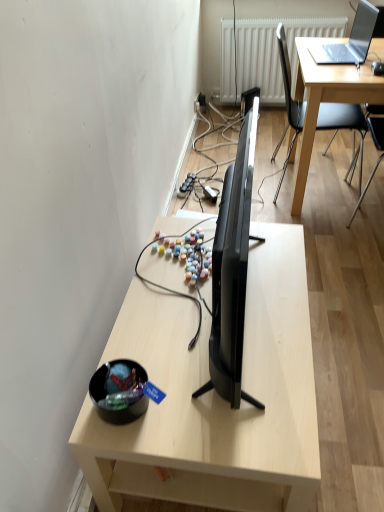
Locate an element on the screen. The width and height of the screenshot is (384, 512). shiny black bowl at lower left is located at coordinates (117, 391).

At what (x,y) coordinates should I click in order to perform the action: click on light wood desk at center. Please return your answer as a coordinate pair (x, y). The image size is (384, 512). Looking at the image, I should click on (215, 397).

Image resolution: width=384 pixels, height=512 pixels. What do you see at coordinates (265, 54) in the screenshot?
I see `white textured radiator at upper center` at bounding box center [265, 54].

You are a GUI agent. You are given a task and a screenshot of the screen. Output one action in this format:
    pyautogui.click(x=<x>, y=<y>)
    Task: Click on the shiny black bowl at lower left
    
    Given the screenshot: What is the action you would take?
    pyautogui.click(x=117, y=391)

From the image's perspective, who appears lower, sleek silver laptop at upper right or white textured radiator at upper center?

sleek silver laptop at upper right, from the image's perspective.

What's the angular difference between sleek silver laptop at upper right and white textured radiator at upper center's facing directions?

84.7 degrees.

The height and width of the screenshot is (512, 384). I want to click on radiator above the sleek silver laptop at upper right (from the image's perspective), so click(265, 54).

Can you confirm if sleek silver laptop at upper right is bigger than white textured radiator at upper center?

No.

Considering the positions of point (293, 138) and point (372, 6), is point (293, 138) closer or farther from the camera than point (372, 6)?

Point (293, 138) appears to be closer to the viewer than point (372, 6).

Looking at this image, is black plastic chair at upper right bigger or smaller than sleek silver laptop at upper right?

Clearly, black plastic chair at upper right is larger in size than sleek silver laptop at upper right.

Image resolution: width=384 pixels, height=512 pixels. I want to click on chair on the left of sleek silver laptop at upper right, so click(x=288, y=103).

From a real-world perspective, is black plastic chair at upper right above or below sleek silver laptop at upper right?

black plastic chair at upper right is below sleek silver laptop at upper right.

Can white textured radiator at upper center be found inside black plastic chair at upper right?

Actually, white textured radiator at upper center is outside black plastic chair at upper right.

Considering the positions of points (297, 128) and (261, 79), is point (297, 128) closer to camera compared to point (261, 79)?

Yes, it is.

Considering the relative sizes of black plastic chair at upper right and white textured radiator at upper center in the image provided, is black plastic chair at upper right shorter than white textured radiator at upper center?

No, black plastic chair at upper right is not shorter than white textured radiator at upper center.

Who is more distant, black plastic chair at upper right or white textured radiator at upper center?

white textured radiator at upper center.

How far apart are white textured radiator at upper center and light wood desk at center?

white textured radiator at upper center is 2.48 meters away from light wood desk at center.

Is light wood desk at center located within white textured radiator at upper center?

No, light wood desk at center is not a part of white textured radiator at upper center.

Is white textured radiator at upper center looking in the opposite direction of light wood desk at center?

No, white textured radiator at upper center's orientation is not away from light wood desk at center.

Which is more to the right, white textured radiator at upper center or light wood desk at center?

From the viewer's perspective, white textured radiator at upper center appears more on the right side.

From the image's perspective, is shiny black bowl at lower left located above or below light wood desk at center?

shiny black bowl at lower left is situated higher than light wood desk at center in the image.

From a real-world perspective, is shiny black bowl at lower left physically below light wood desk at center?

Actually, shiny black bowl at lower left is physically above light wood desk at center in the real world.

Is shiny black bowl at lower left inside the boundaries of light wood desk at center, or outside?

shiny black bowl at lower left is not inside light wood desk at center, it's outside.

Is shiny black bowl at lower left wider or thinner than light wood desk at center?

Clearly, shiny black bowl at lower left has less width compared to light wood desk at center.

Identify the location of chair lying in front of the white textured radiator at upper center. (288, 103).

Is white textured radiator at upper center oriented away from black plastic chair at upper right?

No.

From a real-world perspective, relative to black plastic chair at upper right, is white textured radiator at upper center vertically above or below?

white textured radiator at upper center is situated lower than black plastic chair at upper right in the real world.

Does black glossy tv at center come in front of shiny black bowl at lower left?

Yes, black glossy tv at center is closer to the viewer.

Is black glossy tv at center positioned beyond the bounds of shiny black bowl at lower left?

Yes.

Based on the photo, which object is wider, black glossy tv at center or shiny black bowl at lower left?

With larger width is black glossy tv at center.

Considering the sizes of objects black glossy tv at center and shiny black bowl at lower left in the image provided, who is bigger, black glossy tv at center or shiny black bowl at lower left?

Bigger between the two is black glossy tv at center.

Identify the location of laptop on the right side of white textured radiator at upper center. Image resolution: width=384 pixels, height=512 pixels. (350, 40).

Locate an element on the screen. laptop above the black plastic chair at upper right (from the image's perspective) is located at coordinates (350, 40).

In the scene shown: Considering their positions, is shiny black bowl at lower left positioned closer to black glossy tv at center than light wood desk at center?

Among the two, light wood desk at center is located nearer to black glossy tv at center.

Estimate the real-world distances between objects in this image. Which object is closer to light wood desk at center, black plastic chair at upper right or shiny black bowl at lower left?

shiny black bowl at lower left is positioned closer to the anchor light wood desk at center.

Which object lies further to the anchor point black glossy tv at center, white textured radiator at upper center or light wood desk at center?

white textured radiator at upper center is further to black glossy tv at center.

Based on their spatial positions, is black plastic chair at upper right or sleek silver laptop at upper right closer to white textured radiator at upper center?

The object closer to white textured radiator at upper center is black plastic chair at upper right.

Considering their positions, is sleek silver laptop at upper right positioned further to white textured radiator at upper center than shiny black bowl at lower left?

Based on the image, shiny black bowl at lower left appears to be further to white textured radiator at upper center.

Looking at the image, which one is located closer to white textured radiator at upper center, light wood desk at center or black glossy tv at center?

The object closer to white textured radiator at upper center is black glossy tv at center.

Considering their positions, is white textured radiator at upper center positioned further to black glossy tv at center than shiny black bowl at lower left?

white textured radiator at upper center.

Estimate the real-world distances between objects in this image. Which object is further from shiny black bowl at lower left, sleek silver laptop at upper right or black plastic chair at upper right?

black plastic chair at upper right lies further to shiny black bowl at lower left than the other object.

You are a GUI agent. You are given a task and a screenshot of the screen. Output one action in this format:
    pyautogui.click(x=<x>, y=<y>)
    Task: Click on the desk between black glossy tv at center and black plastic chair at upper right along the z-axis
    
    Given the screenshot: What is the action you would take?
    pyautogui.click(x=215, y=397)

In order to click on television that lies between sleek silver laptop at upper right and light wood desk at center from top to bottom in this screenshot , I will do `click(232, 271)`.

Where is `laptop positioned between black plastic chair at upper right and white textured radiator at upper center from near to far`? This screenshot has width=384, height=512. laptop positioned between black plastic chair at upper right and white textured radiator at upper center from near to far is located at coordinates (350, 40).

I want to click on bowl that lies between sleek silver laptop at upper right and light wood desk at center from top to bottom, so click(117, 391).